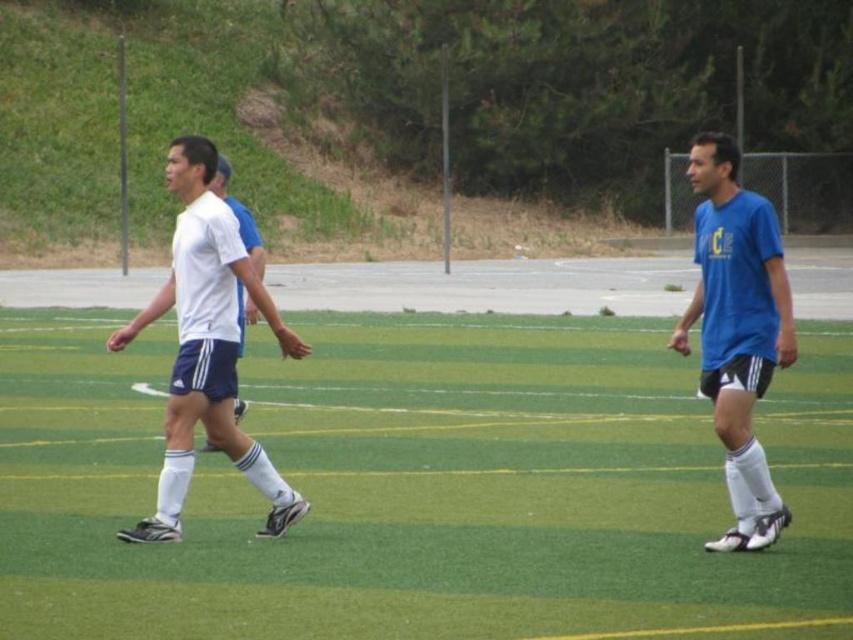
Based on the photo, which of these two, green artificial turf at center or blue matte shirt at center, stands shorter?

Standing shorter between the two is blue matte shirt at center.

The width and height of the screenshot is (853, 640). What are the coordinates of `green artificial turf at center` in the screenshot? It's located at (419, 486).

Consider the image. Which of these two, blue matte shirt at center or white matte shirt at center, stands shorter?

With less height is blue matte shirt at center.

Can you confirm if blue matte shirt at center is positioned below white matte shirt at center?

Yes.

Does point (735, 500) come in front of point (247, 230)?

Yes.

This screenshot has width=853, height=640. I want to click on blue matte shirt at center, so click(x=737, y=330).

Consider the image. Can you confirm if white matte shorts at center is taller than blue matte shirt at center?

In fact, white matte shorts at center may be shorter than blue matte shirt at center.

Does white matte shorts at center have a lesser width compared to blue matte shirt at center?

In fact, white matte shorts at center might be wider than blue matte shirt at center.

Does point (202, 364) come farther from viewer compared to point (714, 234)?

Yes, it is behind point (714, 234).

Locate an element on the screen. This screenshot has height=640, width=853. white matte shorts at center is located at coordinates (207, 346).